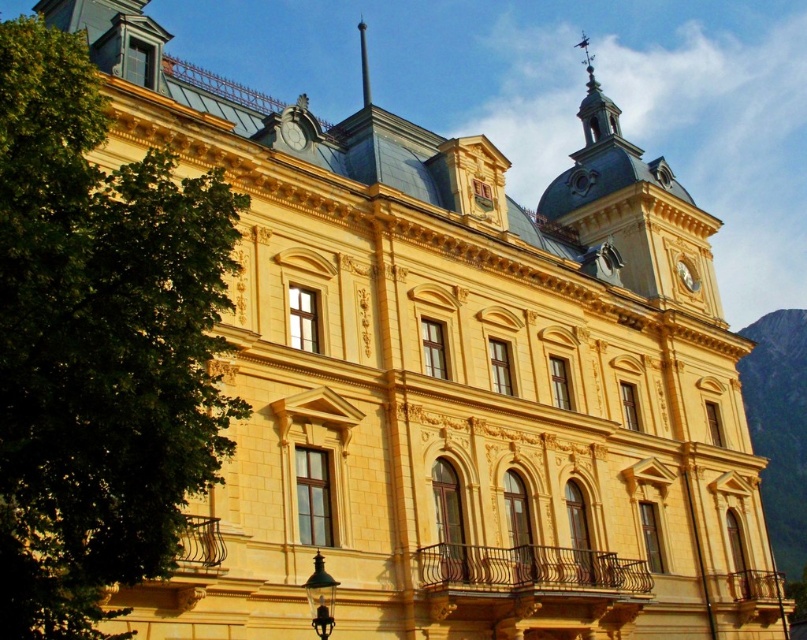
You are standing in front of the grand building and notice two points marked on the facade. The first point is at coordinates point (x=63, y=508) and the second is at point (x=300, y=140). Which point is closer to your current position?

Point (x=63, y=508) is in front of point (x=300, y=140), so it is closer to your current position.

You are standing in front of the grand building and want to know the relative positions of the green leafy tree at left and the gold metallic clock at upper center. Which one is positioned higher up in the image?

The green leafy tree at left is located above the gold metallic clock at upper center, so it is positioned higher up in the image.